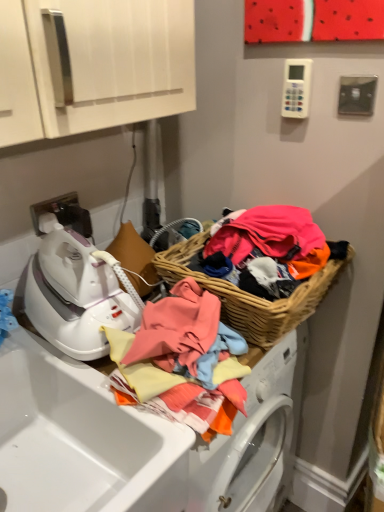
Question: Is white glossy iron at left further to camera compared to woven wood basket at right?

Choices:
 (A) no
 (B) yes

Answer: (A)

Question: From a real-world perspective, is white glossy iron at left located higher than woven wood basket at right?

Choices:
 (A) no
 (B) yes

Answer: (A)

Question: Is white glossy iron at left outside of woven wood basket at right?

Choices:
 (A) no
 (B) yes

Answer: (B)

Question: Does white glossy iron at left have a greater width compared to woven wood basket at right?

Choices:
 (A) no
 (B) yes

Answer: (B)

Question: From the image's perspective, is white glossy iron at left located beneath woven wood basket at right?

Choices:
 (A) yes
 (B) no

Answer: (A)

Question: Can you confirm if white glossy iron at left is thinner than woven wood basket at right?

Choices:
 (A) no
 (B) yes

Answer: (A)

Question: Is woven wood basket at right to the left of white glossy iron at left from the viewer's perspective?

Choices:
 (A) yes
 (B) no

Answer: (B)

Question: Can you confirm if woven wood basket at right is bigger than white glossy iron at left?

Choices:
 (A) yes
 (B) no

Answer: (A)

Question: Is woven wood basket at right smaller than white glossy iron at left?

Choices:
 (A) no
 (B) yes

Answer: (A)

Question: Is woven wood basket at right directly adjacent to white glossy iron at left?

Choices:
 (A) yes
 (B) no

Answer: (B)

Question: Is woven wood basket at right taller than white glossy iron at left?

Choices:
 (A) no
 (B) yes

Answer: (A)

Question: From the image's perspective, does woven wood basket at right appear higher than white glossy iron at left?

Choices:
 (A) yes
 (B) no

Answer: (A)

Question: Is white glossy iron at left behind white glossy sink at lower left?

Choices:
 (A) yes
 (B) no

Answer: (A)